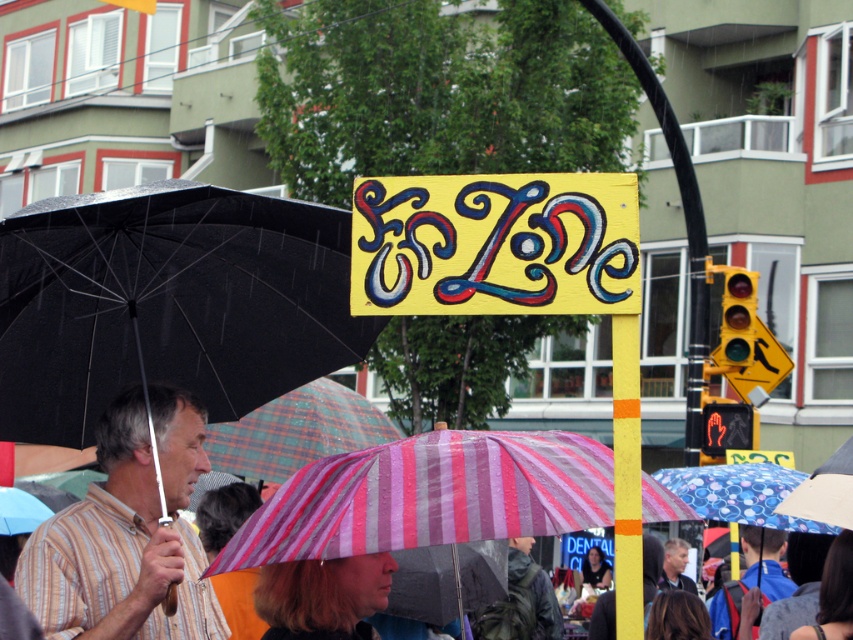
You are standing in the center of the image and want to move towards the black matte umbrella at upper left. In which direction should you move?

You should move towards the upper left direction to reach the black matte umbrella at upper left since its 2D location is at point (167, 301).

Consider the image. You are a pedestrian trying to cross the street while holding an umbrella. You see the black matte umbrella at upper left and the pink striped fabric umbrella at center. Which umbrella is closer to the left side of the street?

The black matte umbrella at upper left is closer to the left side of the street because it is positioned on the left side of the pink striped fabric umbrella at center.